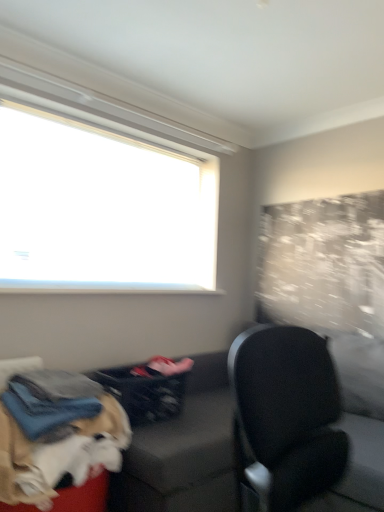
Question: Is dark gray fabric couch at lower left further to camera compared to white fluffy dog at lower left?

Choices:
 (A) no
 (B) yes

Answer: (B)

Question: Is dark gray fabric couch at lower left closer to camera compared to white fluffy dog at lower left?

Choices:
 (A) yes
 (B) no

Answer: (B)

Question: Does dark gray fabric couch at lower left have a greater height compared to white fluffy dog at lower left?

Choices:
 (A) no
 (B) yes

Answer: (B)

Question: Considering the relative sizes of dark gray fabric couch at lower left and white fluffy dog at lower left in the image provided, is dark gray fabric couch at lower left smaller than white fluffy dog at lower left?

Choices:
 (A) no
 (B) yes

Answer: (A)

Question: Does dark gray fabric couch at lower left turn towards white fluffy dog at lower left?

Choices:
 (A) yes
 (B) no

Answer: (B)

Question: Considering the positions of dark gray fabric couch at lower left and white fluffy dog at lower left in the image, is dark gray fabric couch at lower left taller or shorter than white fluffy dog at lower left?

Choices:
 (A) short
 (B) tall

Answer: (B)

Question: Does point (304, 375) appear closer or farther from the camera than point (21, 431)?

Choices:
 (A) closer
 (B) farther

Answer: (A)

Question: Would you say dark gray fabric couch at lower left is to the left or to the right of white fluffy dog at lower left in the picture?

Choices:
 (A) right
 (B) left

Answer: (A)

Question: From the image's perspective, relative to white fluffy dog at lower left, is dark gray fabric couch at lower left above or below?

Choices:
 (A) below
 (B) above

Answer: (A)

Question: Is black leather chair at right taller or shorter than dark gray fabric couch at lower left?

Choices:
 (A) short
 (B) tall

Answer: (B)

Question: Looking at the image, does black leather chair at right seem bigger or smaller compared to dark gray fabric couch at lower left?

Choices:
 (A) small
 (B) big

Answer: (A)

Question: Do you think black leather chair at right is within dark gray fabric couch at lower left, or outside of it?

Choices:
 (A) outside
 (B) inside

Answer: (A)

Question: Would you say black leather chair at right is to the left or to the right of dark gray fabric couch at lower left in the picture?

Choices:
 (A) right
 (B) left

Answer: (A)

Question: Considering the positions of black leather chair at right and dark gray fabric laundry basket at lower center in the image, is black leather chair at right wider or thinner than dark gray fabric laundry basket at lower center?

Choices:
 (A) thin
 (B) wide

Answer: (B)

Question: From the image's perspective, relative to dark gray fabric laundry basket at lower center, is black leather chair at right above or below?

Choices:
 (A) below
 (B) above

Answer: (A)